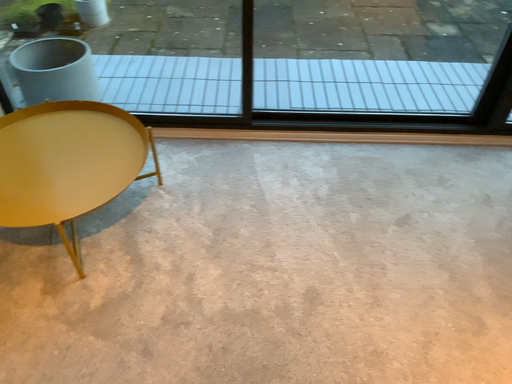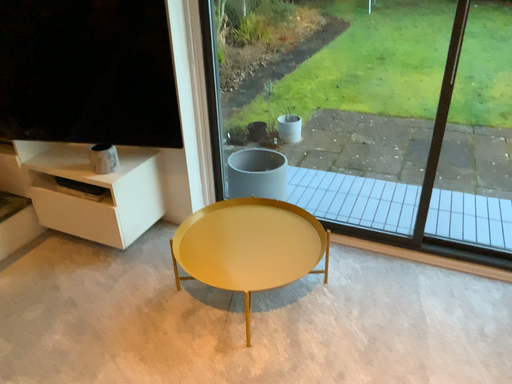
Question: How did the camera likely rotate when shooting the video?

Choices:
 (A) rotated left
 (B) rotated right

Answer: (A)